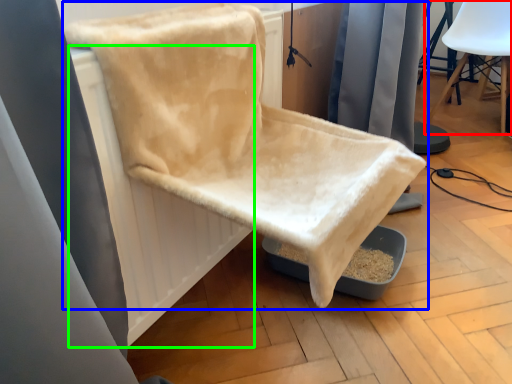
Question: Which object is the closest to the chair (highlighted by a red box)? Choose among these: chair (highlighted by a blue box) or radiator (highlighted by a green box).

Choices:
 (A) chair
 (B) radiator

Answer: (A)